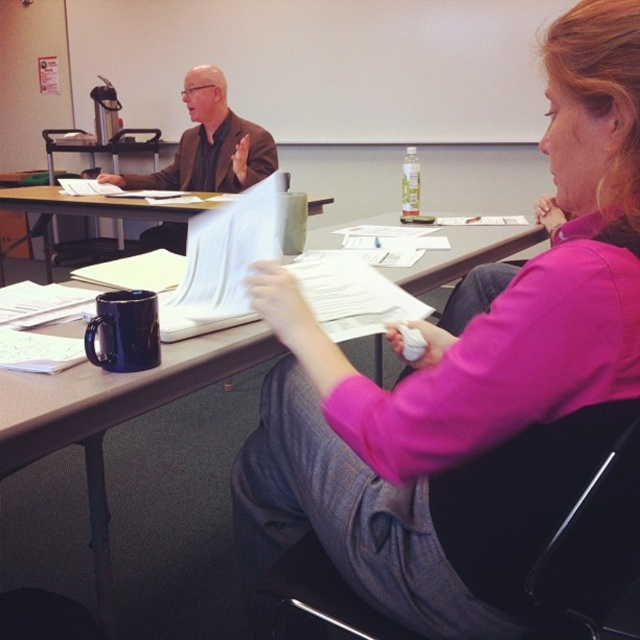
Question: Which point is closer to the camera taking this photo?

Choices:
 (A) (451, 493)
 (B) (577, 397)
 (C) (81, 83)
 (D) (81, 198)

Answer: (B)

Question: Does pink fabric shirt at center appear over matte brown jacket at upper left?

Choices:
 (A) yes
 (B) no

Answer: (B)

Question: Can you confirm if pink fabric shirt at center is thinner than brushed metal water at bottle left?

Choices:
 (A) yes
 (B) no

Answer: (A)

Question: Is black fabric chair at lower right above white paper at center?

Choices:
 (A) no
 (B) yes

Answer: (A)

Question: Which point is farther to the camera?

Choices:
 (A) (8, 410)
 (B) (176, 156)
 (C) (531, 36)
 (D) (611, 531)

Answer: (C)

Question: Which is farther from the matte black mug at center?

Choices:
 (A) pink fabric shirt at center
 (B) brushed metal water at bottle left

Answer: (B)